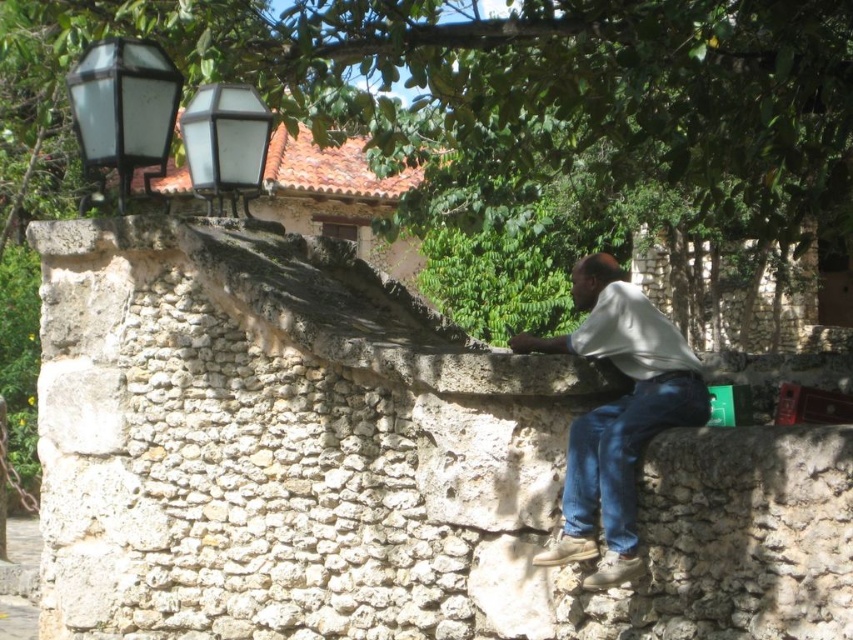
You are standing at the origin point in the image. The blue denim jeans at lower right is represented by point (622, 452). What is the coordinate of the blue denim jeans at lower right?

The coordinate of the blue denim jeans at lower right is point (622, 452).

You are standing at the point marked as point (372, 464) in the image. What material are you standing on?

You are standing on white rough stone at center.